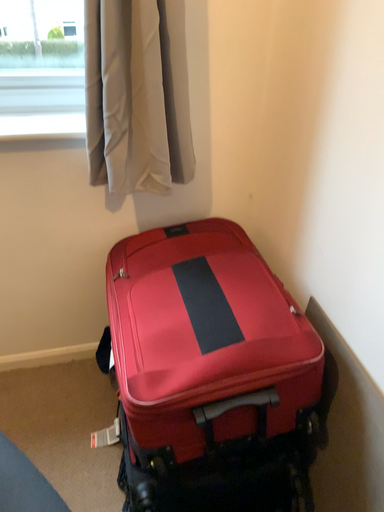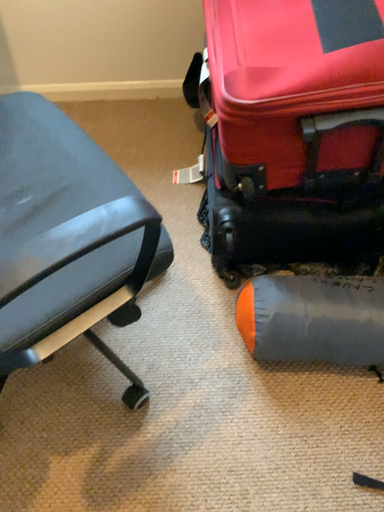
Question: How did the camera likely rotate when shooting the video?

Choices:
 (A) rotated right
 (B) rotated left

Answer: (B)